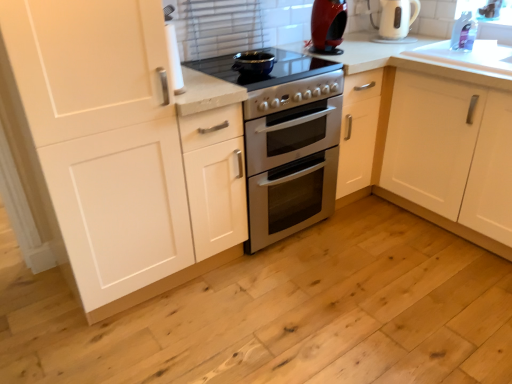
This screenshot has height=384, width=512. Find the location of `free spot below shiny red coffee machine at upper center (from a real-world perspective)`. free spot below shiny red coffee machine at upper center (from a real-world perspective) is located at coordinates (328, 48).